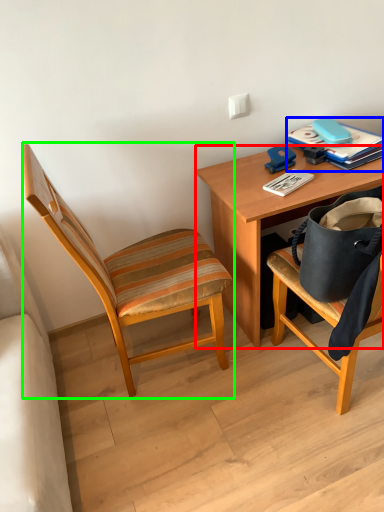
Question: Considering the real-world distances, which object is closest to desk (highlighted by a red box)? paperback book (highlighted by a blue box) or chair (highlighted by a green box).

Choices:
 (A) paperback book
 (B) chair

Answer: (A)